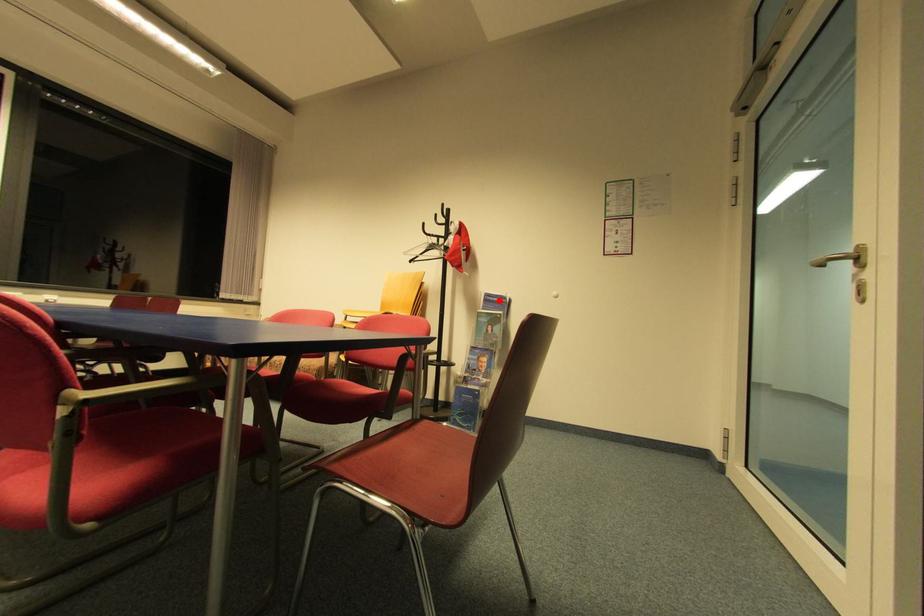
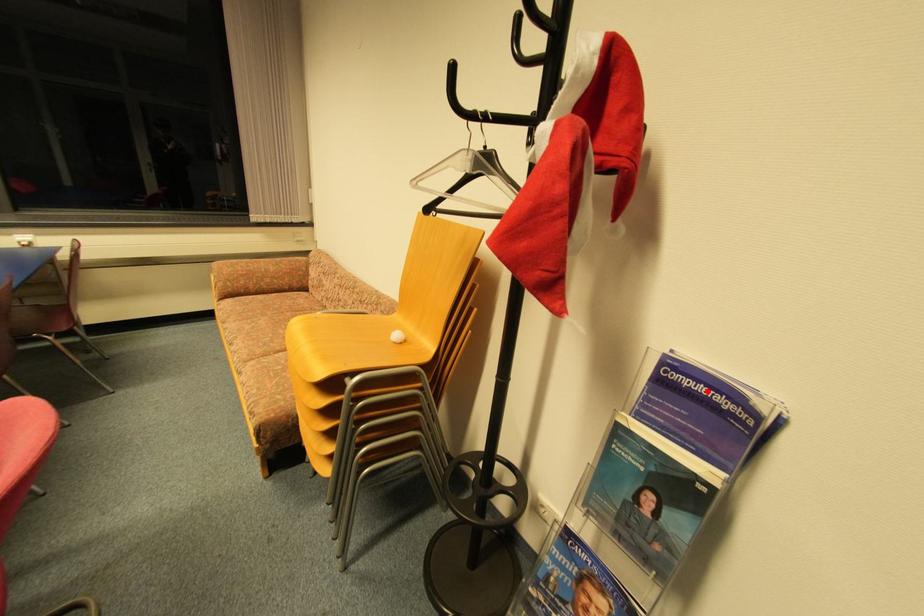
I am providing you with two images of the same scene from different viewpoints. A red point is marked on the first image and another point is marked on the second image. Is the red point in image1 aligned with the point shown in image2?

Yes